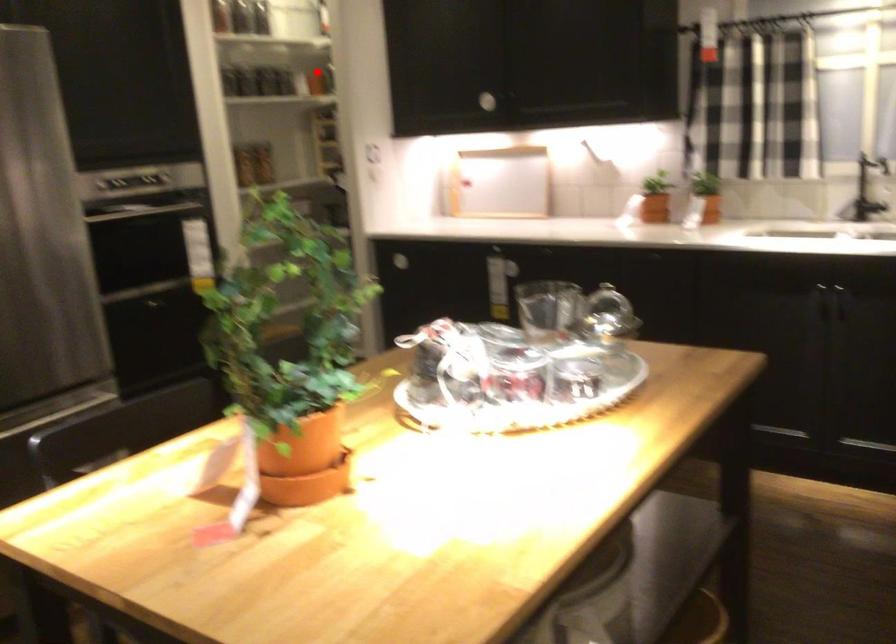
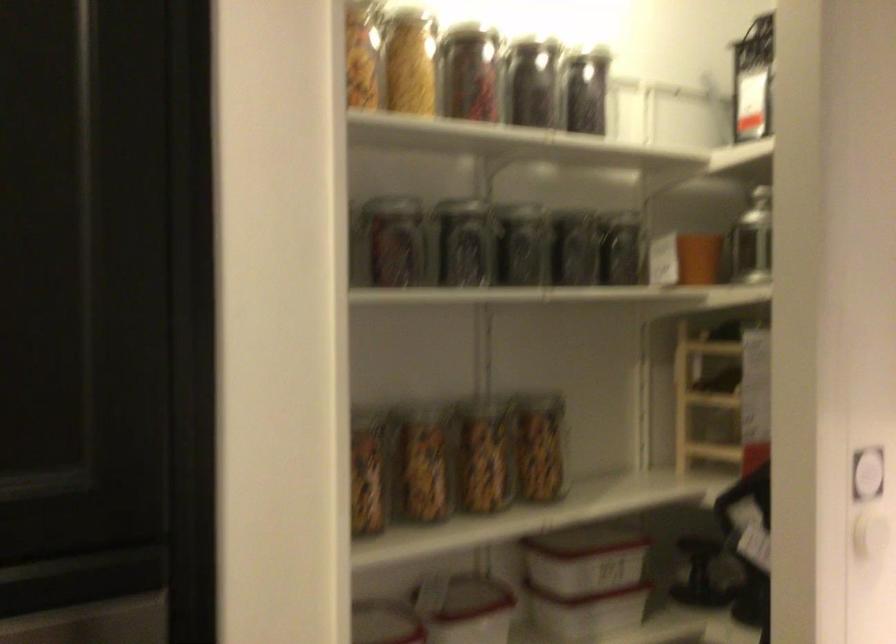
Question: A red point is marked in image1. In image2, is the corresponding 3D point closer to the camera or farther? Reply with the corresponding letter.

Choices:
 (A) The corresponding 3D point is closer.
 (B) The corresponding 3D point is farther.

Answer: (A)